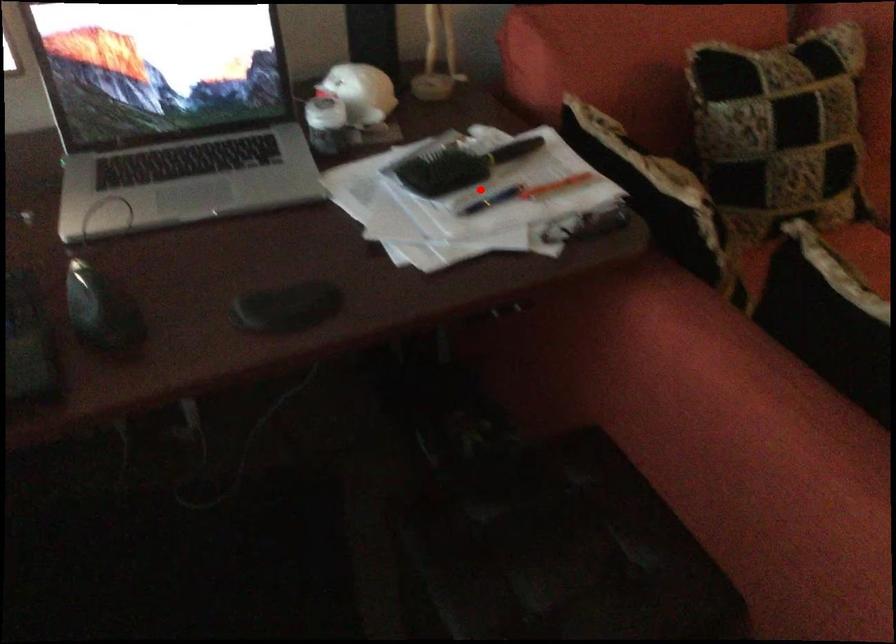
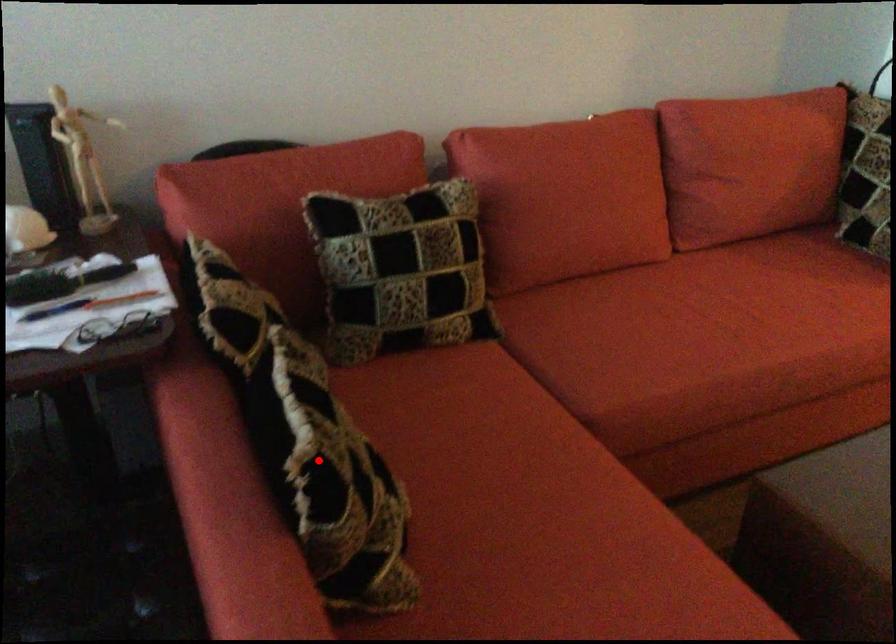
I am providing you with two images of the same scene from different viewpoints. A red point is marked on the first image and another point is marked on the second image. Is the red point in image1 aligned with the point shown in image2?

No